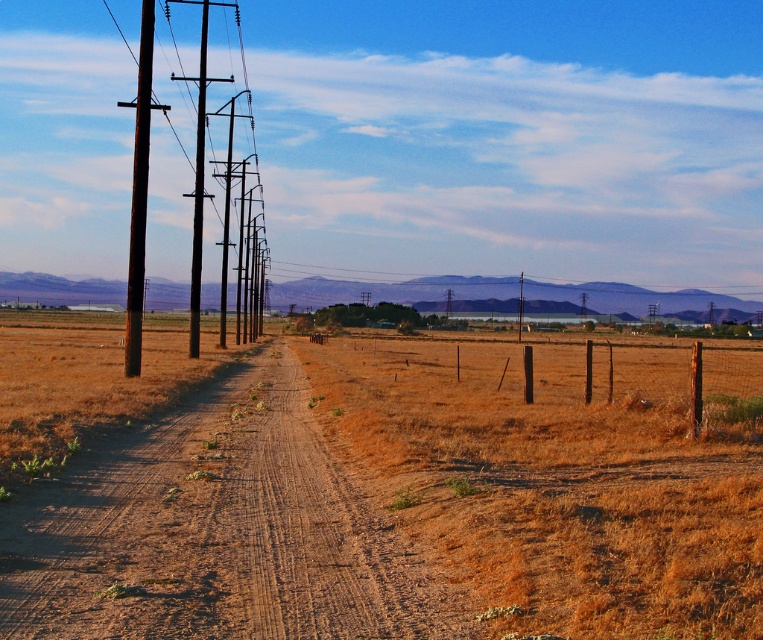
Is brown wire fence at center closer to the viewer compared to metallic gray power line at center?

Yes, brown wire fence at center is in front of metallic gray power line at center.

Is point (462, 362) positioned in front of point (646, 291)?

Yes, point (462, 362) is in front of point (646, 291).

This screenshot has height=640, width=763. Describe the element at coordinates (498, 380) in the screenshot. I see `brown wire fence at center` at that location.

You are a GUI agent. You are given a task and a screenshot of the screen. Output one action in this format:
    pyautogui.click(x=<x>, y=<y>)
    Task: Click on the brown wire fence at center
    Image resolution: width=763 pixels, height=640 pixels.
    Given the screenshot: What is the action you would take?
    pyautogui.click(x=498, y=380)

How far apart are metallic gray power line at center and brown wooden telegraph pole at left?

66.36 meters

Is metallic gray power line at center closer to camera compared to brown wooden telegraph pole at left?

No, metallic gray power line at center is further to the viewer.

Does point (539, 289) come closer to viewer compared to point (201, 38)?

Yes, it is.

Find the location of `metallic gray power line at center`. metallic gray power line at center is located at coordinates (393, 289).

Measure the distance from rusty metal telegraph pole at left to brown wooden telegraph pole at left.

They are 11.77 meters apart.

Does rusty metal telegraph pole at left appear over brown wooden telegraph pole at left?

Yes, rusty metal telegraph pole at left is above brown wooden telegraph pole at left.

Which is behind, point (143, 44) or point (198, 307)?

The point (143, 44) is behind.

Find the location of a particular element. Image resolution: width=763 pixels, height=640 pixels. rusty metal telegraph pole at left is located at coordinates (139, 193).